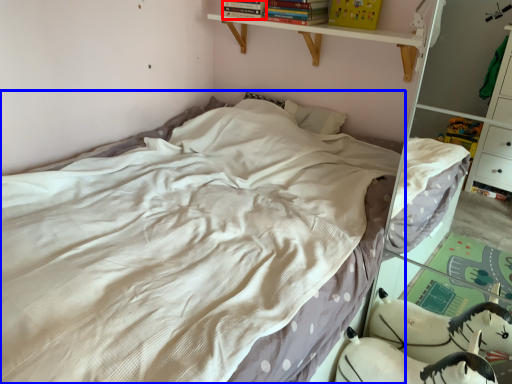
Question: Which object appears farthest to the camera in this image, book (highlighted by a red box) or bed (highlighted by a blue box)?

Choices:
 (A) book
 (B) bed

Answer: (A)